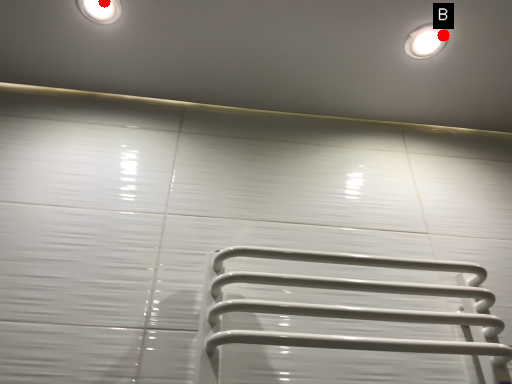
Question: Two points are circled on the image, labeled by A and B beside each circle. Which point appears farthest from the camera in this image?

Choices:
 (A) A is further
 (B) B is further

Answer: (B)